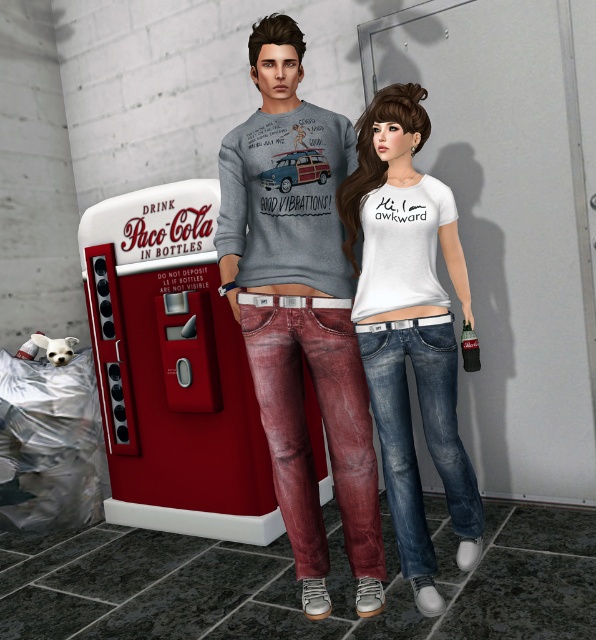
Question: Which of these objects is positioned closest to the metallic red vending machine at center?

Choices:
 (A) matte gray sweatshirt at center
 (B) white matte t-shirt at center

Answer: (A)

Question: Can you confirm if matte gray sweatshirt at center is positioned to the left of white matte t-shirt at center?

Choices:
 (A) no
 (B) yes

Answer: (B)

Question: Is matte gray sweatshirt at center positioned at the back of white matte t-shirt at center?

Choices:
 (A) no
 (B) yes

Answer: (A)

Question: Which object is positioned farthest from the metallic red vending machine at center?

Choices:
 (A) white matte t-shirt at center
 (B) matte gray sweatshirt at center

Answer: (A)

Question: Is metallic red vending machine at center above white matte t-shirt at center?

Choices:
 (A) no
 (B) yes

Answer: (A)

Question: Which point appears closest to the camera in this image?

Choices:
 (A) 429,406
 (B) 225,413

Answer: (A)